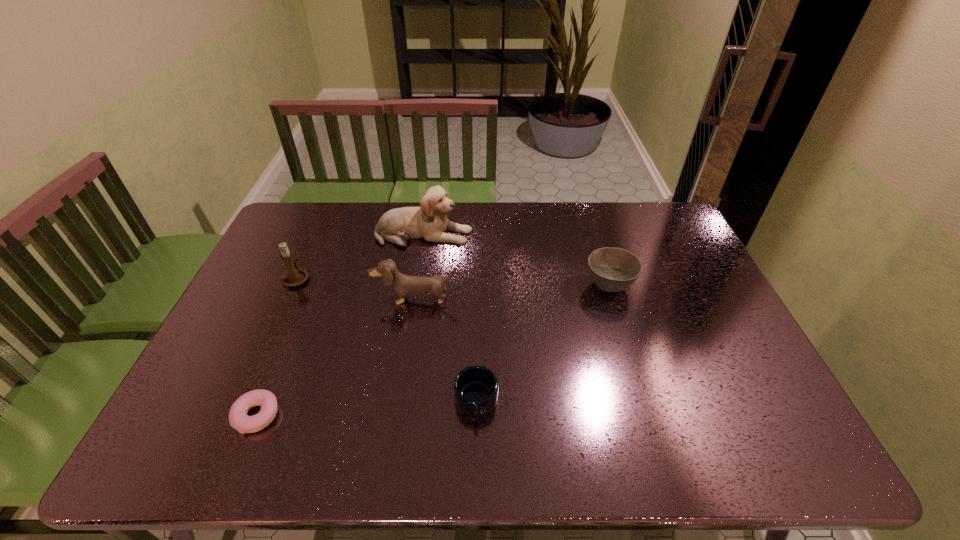
Locate an element on the screen. free region located 0.270m on the side of the candle holder with the handle is located at coordinates (323, 219).

This screenshot has width=960, height=540. In order to click on vacant space located on the side of the candle holder with the handle in this screenshot , I will do `click(328, 206)`.

I want to click on vacant region located at the face of the nearer puppy, so click(x=411, y=327).

This screenshot has width=960, height=540. I want to click on free space located on the back of the rightmost object, so click(x=590, y=222).

Where is `vacant space located with the handle on the side of the mug`? vacant space located with the handle on the side of the mug is located at coordinates (476, 448).

You are a GUI agent. You are given a task and a screenshot of the screen. Output one action in this format:
    pyautogui.click(x=<x>, y=<y>)
    Task: Click on the vacant space positioned on the back of the doughnut
    
    Given the screenshot: What is the action you would take?
    pyautogui.click(x=272, y=379)

Identify the location of object at the far edge. This screenshot has height=540, width=960. (429, 221).

I want to click on object situated at the near edge, so click(x=238, y=418).

At what (x,y) coordinates should I click in order to perform the action: click on candle holder present at the left edge. Please return your answer as a coordinate pair (x, y). This screenshot has height=540, width=960. Looking at the image, I should click on (294, 277).

The image size is (960, 540). In order to click on doughnut located at the left edge in this screenshot , I will do `click(238, 418)`.